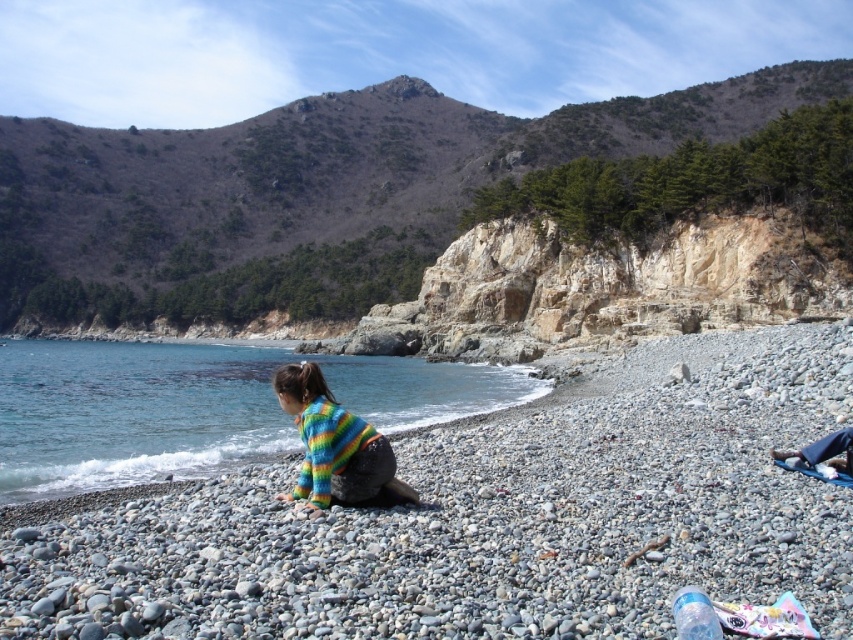
You are a photographer trying to capture the smooth pebbles at center and the multicolored knitted sweater at center in a single frame. Based on their sizes, which object should you focus on to ensure both are clearly visible in the photo?

Since the smooth pebbles at center are wider than the multicolored knitted sweater at center, you should focus on the smooth pebbles at center to ensure both objects are clearly visible in the photo.

You are a hiker who wants to climb the rocky cliff at upper center. You have a backpack that can carry items up to 10 kg. The multicolored knitted sweater at center is currently being worn by a child. If you take the sweater and add it to your backpack, will you still have enough space to carry a 5 kg water bottle?

The rocky cliff at upper center is taller than the multicolored knitted sweater at center. However, the sweater is lightweight. Since the backpack can carry up to 10 kg, adding the sweater and the 5 kg water bottle would depend on the sweater weight. But the description only mentions height, not weight. Thus, we cannot determine if there is enough space based on the given information.